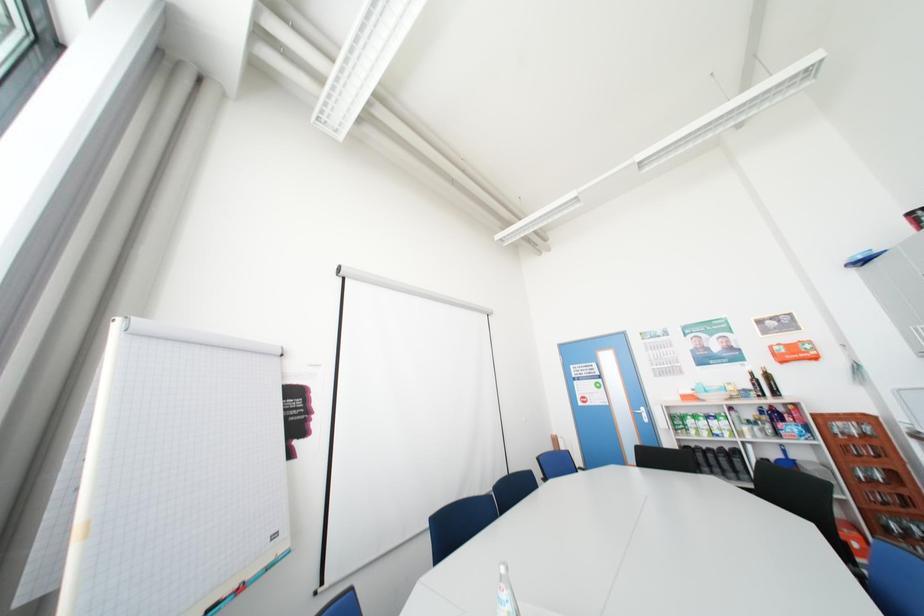
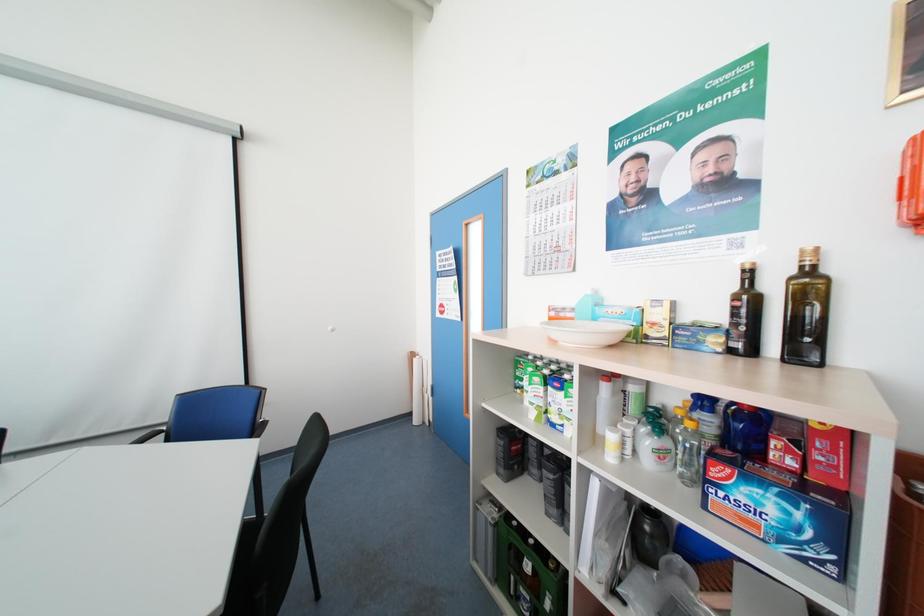
In a continuous first-person perspective shot, in which direction is the camera moving?

The cameraman walked toward right, forward.